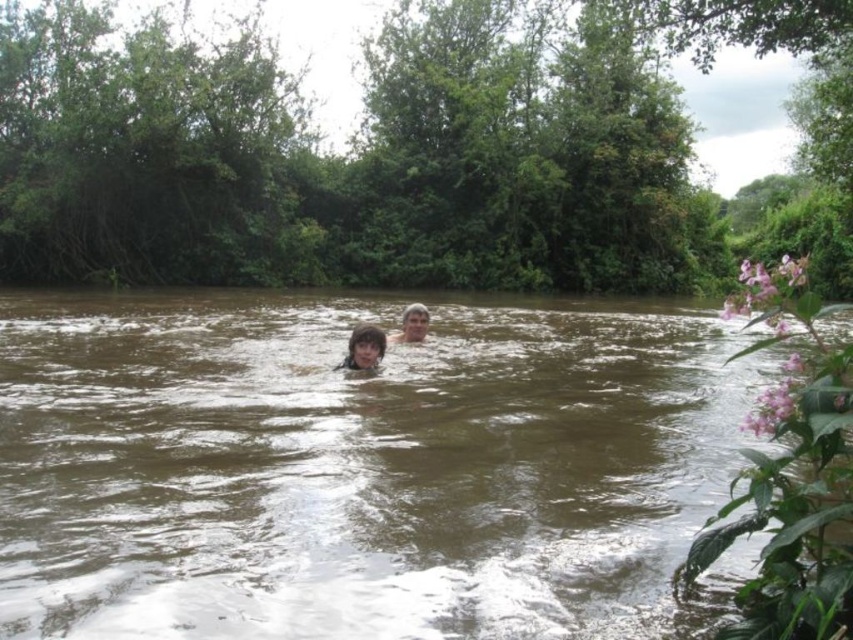
Question: Can you confirm if brown muddy water at center is thinner than light brown hair at center?

Choices:
 (A) yes
 (B) no

Answer: (B)

Question: Estimate the real-world distances between objects in this image. Which object is farther from the brown muddy water at center?

Choices:
 (A) brown hair at center
 (B) light brown hair at center

Answer: (A)

Question: Does brown muddy water at center appear over brown hair at center?

Choices:
 (A) yes
 (B) no

Answer: (A)

Question: Which object is the closest to the brown hair at center?

Choices:
 (A) light brown hair at center
 (B) brown muddy water at center

Answer: (A)

Question: Does brown hair at center come in front of light brown hair at center?

Choices:
 (A) yes
 (B) no

Answer: (A)

Question: Which is nearer to the light brown hair at center?

Choices:
 (A) brown muddy water at center
 (B) brown hair at center

Answer: (B)